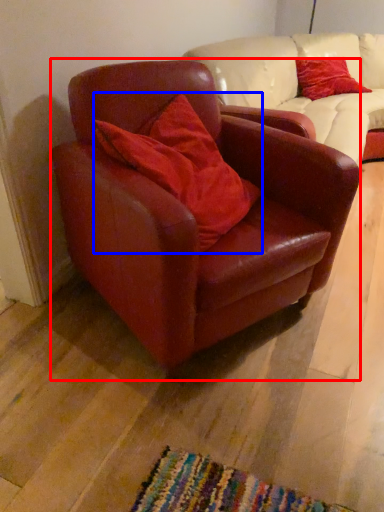
Question: Which point is further to the camera, chair (highlighted by a red box) or pillow (highlighted by a blue box)?

Choices:
 (A) chair
 (B) pillow

Answer: (B)